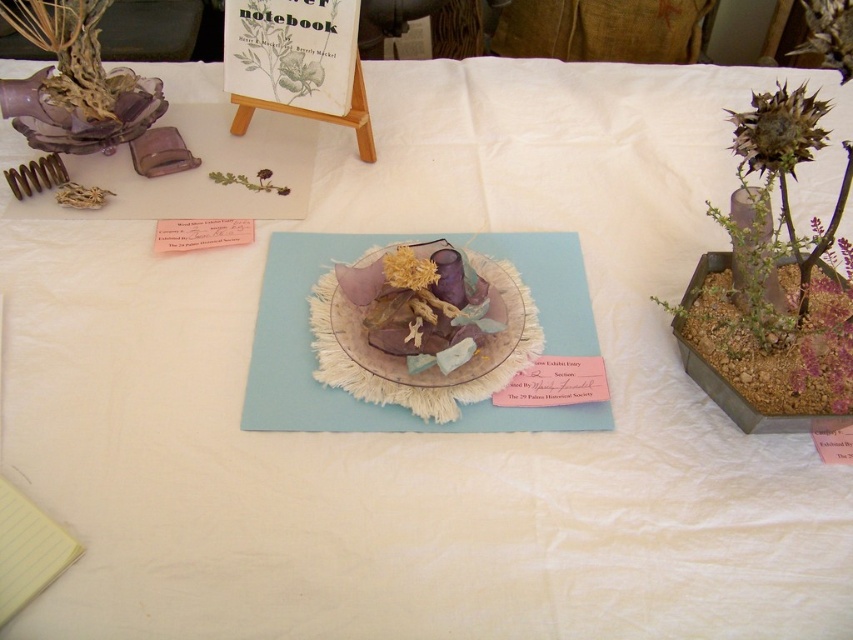
You are a florist arranging flowers for a client. The client wants to know if the brown textured flower at upper right can be placed 12 inches away from the fuzzy golden flower at center. Based on the image, is this possible?

The distance between the brown textured flower at upper right and the fuzzy golden flower at center is 11.87 inches, so yes, the client can place the brown textured flower at upper right 12 inches away from the fuzzy golden flower at center as it is already close to that distance.